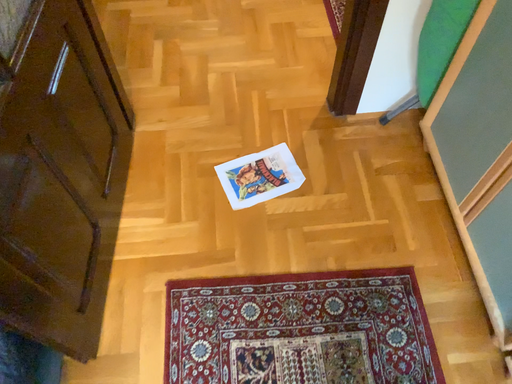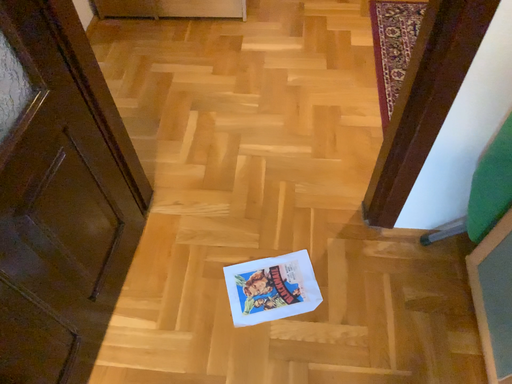
Question: Which way did the camera rotate in the video?

Choices:
 (A) rotated right
 (B) rotated left

Answer: (B)